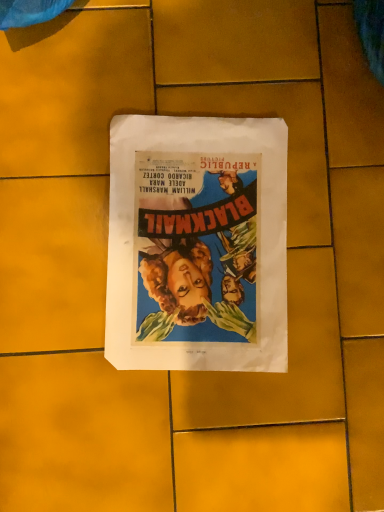
Find the location of a particular element. The height and width of the screenshot is (512, 384). matte paper poster at center is located at coordinates (197, 244).

What do you see at coordinates (197, 244) in the screenshot? I see `matte paper poster at center` at bounding box center [197, 244].

Where is `matte paper poster at center`? This screenshot has width=384, height=512. matte paper poster at center is located at coordinates (197, 244).